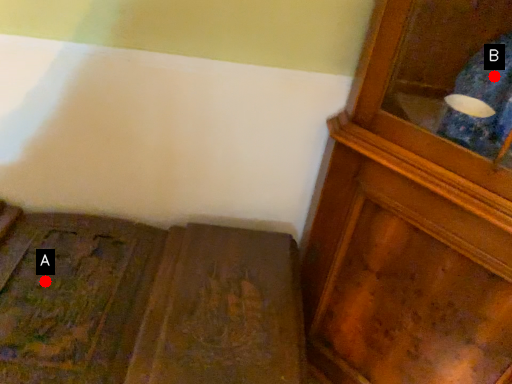
Question: Two points are circled on the image, labeled by A and B beside each circle. Among these points, which one is nearest to the camera?

Choices:
 (A) A is closer
 (B) B is closer

Answer: (B)